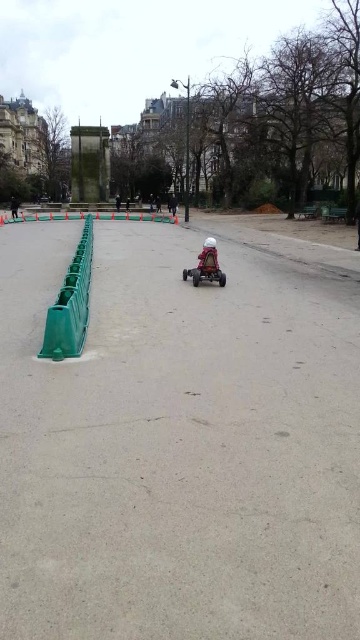
Question: Does matte red toy car at center appear on the left side of matte red car at center?

Choices:
 (A) no
 (B) yes

Answer: (A)

Question: Which point is farther to the camera?

Choices:
 (A) matte red car at center
 (B) matte red toy car at center

Answer: (A)

Question: Among these points, which one is farthest from the camera?

Choices:
 (A) (201, 250)
 (B) (15, 209)

Answer: (B)

Question: Does matte red toy car at center appear under matte red car at center?

Choices:
 (A) yes
 (B) no

Answer: (A)

Question: Does matte red toy car at center appear over matte red car at center?

Choices:
 (A) no
 (B) yes

Answer: (A)

Question: Which object appears farthest from the camera in this image?

Choices:
 (A) matte red toy car at center
 (B) matte red car at center

Answer: (B)